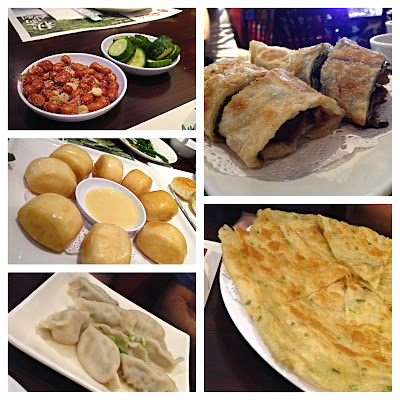
Identify the location of table. (147, 107).